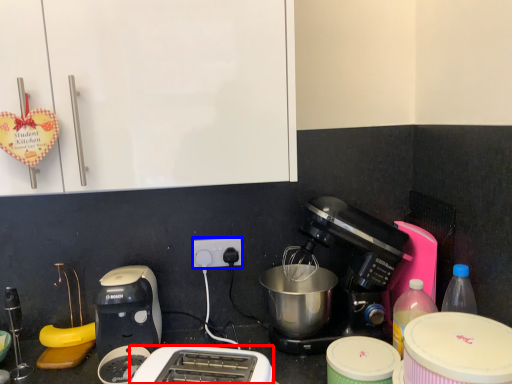
Question: Among these objects, which one is nearest to the camera, toaster (highlighted by a red box) or power plugs and sockets (highlighted by a blue box)?

Choices:
 (A) toaster
 (B) power plugs and sockets

Answer: (A)